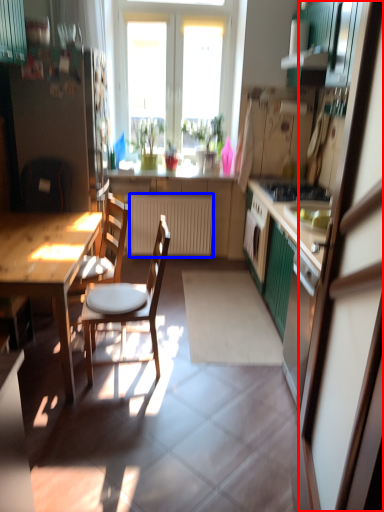
Question: Which point is further to the camera, screen door (highlighted by a red box) or radiator (highlighted by a blue box)?

Choices:
 (A) screen door
 (B) radiator

Answer: (B)